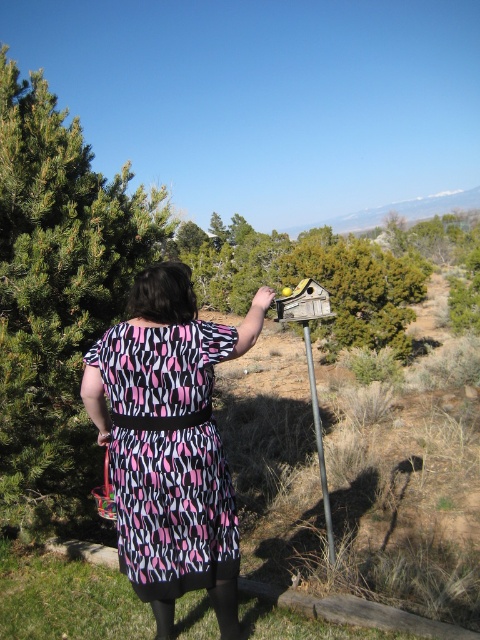
Can you confirm if green leafy tree at left is wider than metallic pole at center?

Incorrect, green leafy tree at left's width does not surpass metallic pole at center's.

Does green leafy tree at left have a greater height compared to metallic pole at center?

No, green leafy tree at left is not taller than metallic pole at center.

Where is `green leafy tree at left`? The width and height of the screenshot is (480, 640). green leafy tree at left is located at coordinates (58, 291).

Measure the distance between pink and black dotted fabric dress at center and camera.

They are 2.60 meters apart.

Is pink and black dotted fabric dress at center thinner than metallic pole at center?

Incorrect, pink and black dotted fabric dress at center's width is not less than metallic pole at center's.

Find the location of a particular element. This screenshot has width=480, height=640. pink and black dotted fabric dress at center is located at coordinates (168, 456).

You are a GUI agent. You are given a task and a screenshot of the screen. Output one action in this format:
    pyautogui.click(x=<x>, y=<y>)
    Task: Click on the pink and black dotted fabric dress at center
    
    Given the screenshot: What is the action you would take?
    pyautogui.click(x=168, y=456)

Who is more distant from viewer, (56, 336) or (124, 401)?

The point (56, 336) is behind.

Is green leafy tree at left further to the viewer compared to pink and black dotted fabric dress at center?

Yes.

Where is `green leafy tree at left`? This screenshot has width=480, height=640. green leafy tree at left is located at coordinates (58, 291).